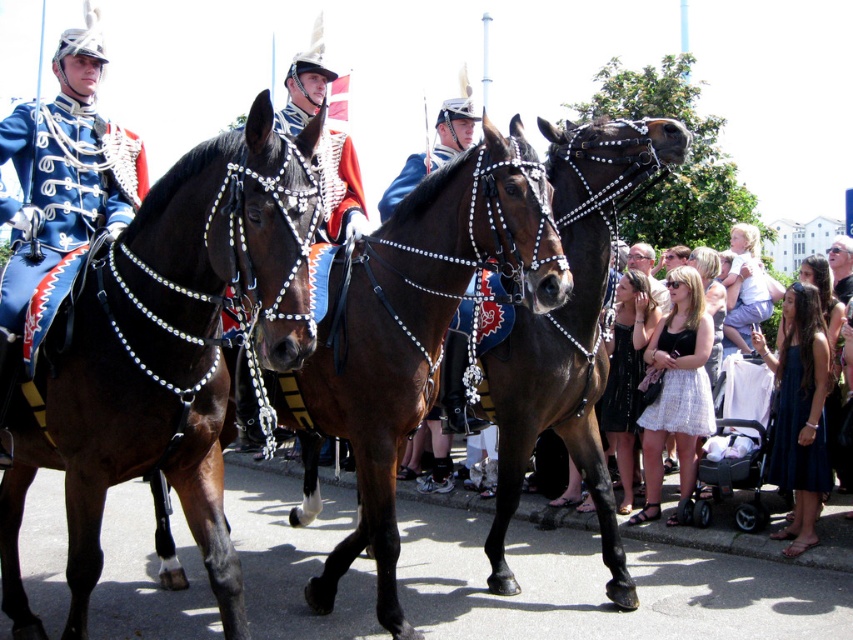
You are a photographer trying to capture the mounted soldiers in the parade. You notice two points of interest marked as point 1 at coordinates (277,236) and point 2 at coordinates (4,310). Which point is closer to your camera lens?

Point 1 at coordinates (277,236) is closer to the camera lens than point 2 at coordinates (4,310).

You are a photographer trying to capture a photo of the shiny brown horse at center and the white cotton dress at lower right. Since you want both subjects to be in focus, you need to know which one is taller. Can you determine which is taller?

The shiny brown horse at center has a greater height compared to the white cotton dress at lower right, so the shiny brown horse at center is taller and will require adjusting the camera settings accordingly to ensure both are in focus.

You are a photographer at the parade and want to capture a photo of the navy satin dress at lower right. Where should you position your camera to ensure the dress is in the frame?

The navy satin dress at lower right is located at point 0.673 on the x axis and 0.936 on the y axis, so position the camera to focus on that coordinate to include the dress in the frame.